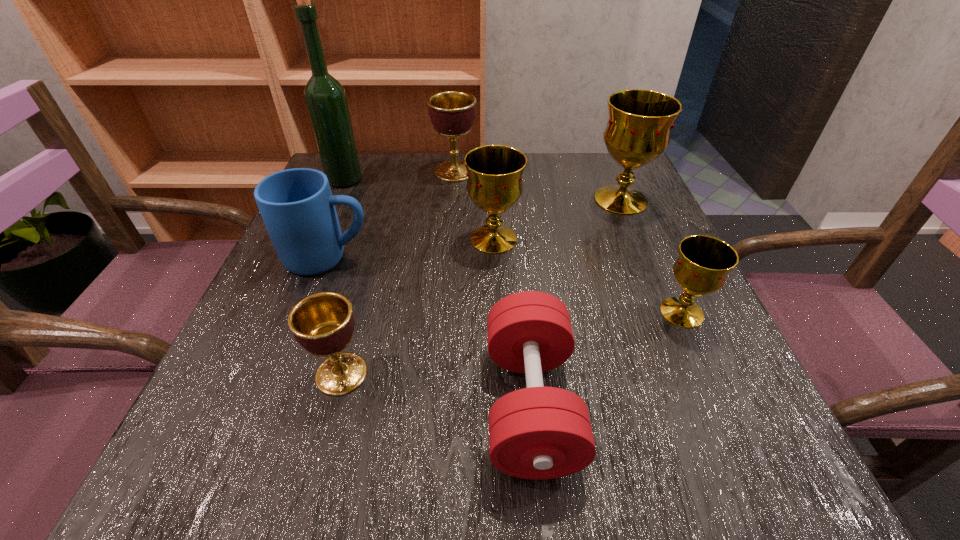
Where is `free space between the mug and the farther golden chalice`? free space between the mug and the farther golden chalice is located at coordinates (392, 215).

Identify the location of free spot between the farther golden chalice and the mug. This screenshot has height=540, width=960. (392, 215).

Find the location of a particular element. vacant area between the second nearest chalice and the farthest chalice is located at coordinates (568, 242).

Locate which object is the sixth closest to the dumbbell. Please provide its 2D coordinates. Your answer should be formatted as a tuple, i.e. [(x, y)], where the tuple contains the x and y coordinates of a point satisfying the conditions above.

[(452, 113)]

Image resolution: width=960 pixels, height=540 pixels. I want to click on the third closest object to the third farthest chalice, so click(297, 207).

Point out which chalice is positioned as the third nearest to the sixth farthest object. Please provide its 2D coordinates. Your answer should be formatted as a tuple, i.e. [(x, y)], where the tuple contains the x and y coordinates of a point satisfying the conditions above.

[(322, 323)]

Image resolution: width=960 pixels, height=540 pixels. Find the location of `chalice object that ranks as the closest to the nearer golden chalice`. chalice object that ranks as the closest to the nearer golden chalice is located at coordinates (494, 184).

Choose which gold chalice is the second nearest neighbor to the tallest object. Please provide its 2D coordinates. Your answer should be formatted as a tuple, i.e. [(x, y)], where the tuple contains the x and y coordinates of a point satisfying the conditions above.

[(638, 130)]

Locate which gold chalice ranks third in proximity to the left golden chalice. Please provide its 2D coordinates. Your answer should be formatted as a tuple, i.e. [(x, y)], where the tuple contains the x and y coordinates of a point satisfying the conditions above.

[(638, 130)]

The height and width of the screenshot is (540, 960). I want to click on blank area in the image that satisfies the following two spatial constraints: 1. on the front side of the dumbbell; 2. on the right side of the right golden chalice, so click(436, 404).